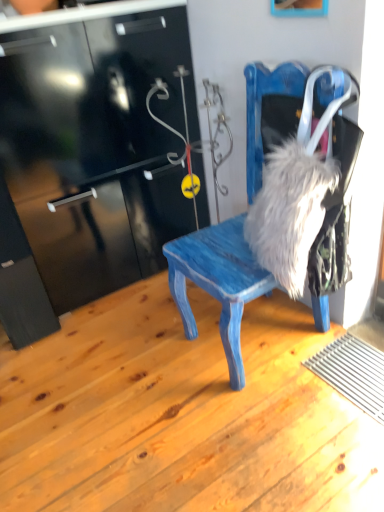
Question: Should I look upward or downward to see wooden picture frame at upper center?

Choices:
 (A) down
 (B) up

Answer: (B)

Question: Does blue painted wood chair at center have a greater height compared to fuzzy gray fur at right?

Choices:
 (A) yes
 (B) no

Answer: (A)

Question: Considering the relative sizes of blue painted wood chair at center and fuzzy gray fur at right in the image provided, is blue painted wood chair at center smaller than fuzzy gray fur at right?

Choices:
 (A) no
 (B) yes

Answer: (A)

Question: Considering the relative positions of blue painted wood chair at center and fuzzy gray fur at right in the image provided, is blue painted wood chair at center behind fuzzy gray fur at right?

Choices:
 (A) no
 (B) yes

Answer: (A)

Question: Considering the relative sizes of blue painted wood chair at center and fuzzy gray fur at right in the image provided, is blue painted wood chair at center wider than fuzzy gray fur at right?

Choices:
 (A) no
 (B) yes

Answer: (B)

Question: Is blue painted wood chair at center bigger than fuzzy gray fur at right?

Choices:
 (A) yes
 (B) no

Answer: (A)

Question: From a real-world perspective, is blue painted wood chair at center positioned over fuzzy gray fur at right based on gravity?

Choices:
 (A) no
 (B) yes

Answer: (B)

Question: Considering the relative sizes of wooden picture frame at upper center and blue painted wood chair at center in the image provided, is wooden picture frame at upper center thinner than blue painted wood chair at center?

Choices:
 (A) yes
 (B) no

Answer: (A)

Question: Are wooden picture frame at upper center and blue painted wood chair at center making contact?

Choices:
 (A) yes
 (B) no

Answer: (B)

Question: Is wooden picture frame at upper center not near blue painted wood chair at center?

Choices:
 (A) yes
 (B) no

Answer: (B)

Question: Is wooden picture frame at upper center turned away from blue painted wood chair at center?

Choices:
 (A) yes
 (B) no

Answer: (B)

Question: Is wooden picture frame at upper center aimed at blue painted wood chair at center?

Choices:
 (A) yes
 (B) no

Answer: (B)

Question: Does wooden picture frame at upper center come behind blue painted wood chair at center?

Choices:
 (A) yes
 (B) no

Answer: (A)

Question: Is blue painted wood chair at center in front of wooden picture frame at upper center?

Choices:
 (A) yes
 (B) no

Answer: (A)